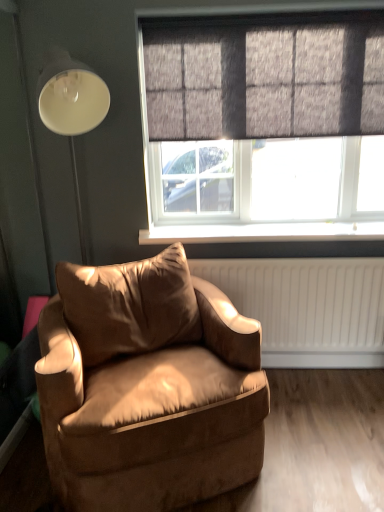
Question: Considering the positions of suede-like brown armchair at lower left and dark grey textured curtain at upper center in the image, is suede-like brown armchair at lower left bigger or smaller than dark grey textured curtain at upper center?

Choices:
 (A) big
 (B) small

Answer: (A)

Question: Is suede-like brown armchair at lower left taller or shorter than dark grey textured curtain at upper center?

Choices:
 (A) tall
 (B) short

Answer: (A)

Question: Based on their relative distances, which object is nearer to the dark grey textured curtain at upper center?

Choices:
 (A) textured gray window at upper center
 (B) white plastic window sill at center
 (C) suede-like brown armchair at lower left

Answer: (A)

Question: Which object is positioned closest to the dark grey textured curtain at upper center?

Choices:
 (A) suede-like brown armchair at lower left
 (B) textured gray window at upper center
 (C) white plastic window sill at center

Answer: (B)